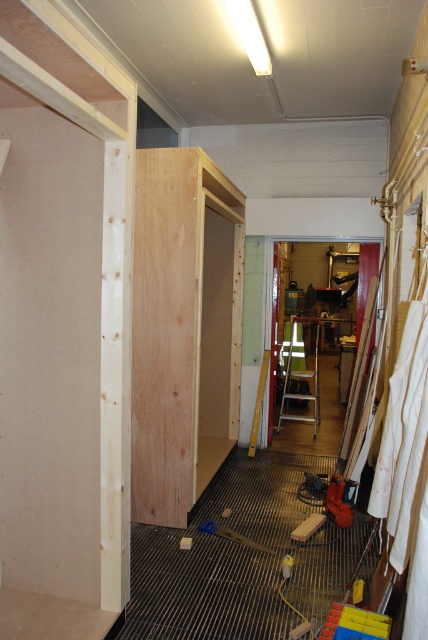
You are a contractor carrying a 3 meter long pipe. You are standing at the wooden step ladder at center and want to move to the wooden plank at center. Can you move the pipe horizontally without tilting it while moving between them?

The wooden step ladder at center and wooden plank at center are 2.82 meters apart from each other. Since the pipe is 3 meters long, which is longer than the distance between them, you cannot move the pipe horizontally without tilting it while moving between them.

You are a construction worker needing to reach a high point on the wall. You see a wooden step ladder at center and a wooden plank at center. Which object should you use to stand on to reach higher?

The wooden plank at center is behind the wooden step ladder at center, so the wooden step ladder at center is the correct tool to use for reaching higher areas.

You are a construction worker carrying a 3.5 meter long metal beam. You are standing in the middle of the room and see the natural wood panel at center and the wooden step ladder at center. Can you safely move the beam between them without needing to adjust their positions?

The natural wood panel at center and wooden step ladder at center are 2.87 meters apart. Since the beam is 3.5 meters long, it is longer than the distance between them. Therefore, you cannot safely move the beam between them without adjusting their positions.